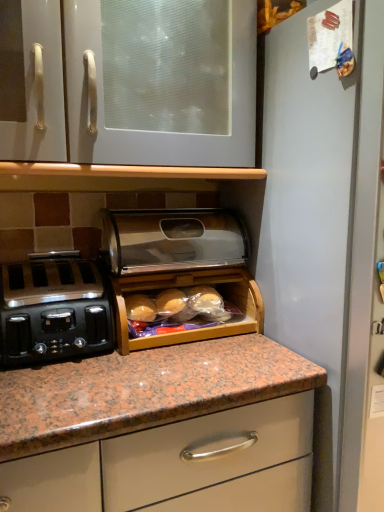
The image size is (384, 512). What do you see at coordinates (129, 82) in the screenshot? I see `white glossy cabinet at upper center` at bounding box center [129, 82].

This screenshot has width=384, height=512. What do you see at coordinates (53, 310) in the screenshot?
I see `satin black toaster at left` at bounding box center [53, 310].

Identify the location of wooden bread box at center, which is the first appliance from bottom to top. (180, 266).

At what (x,y) coordinates should I click in order to perform the action: click on polished stainless steel bread box at center, which appears as the 1th appliance when viewed from the top. Please return your answer as a coordinate pair (x, y). Looking at the image, I should click on (173, 240).

Which of these two, satin black toaster at left or polished stainless steel bread box at center, the 2th appliance ordered from the bottom, is smaller?

satin black toaster at left.

Is satin black toaster at left facing away from polished stainless steel bread box at center, the 2th appliance ordered from the bottom?

No, satin black toaster at left is not facing the opposite direction of polished stainless steel bread box at center, the 2th appliance ordered from the bottom.

From the image's perspective, is satin black toaster at left on polished stainless steel bread box at center, which appears as the 1th appliance when viewed from the top?

No, from the image's perspective, satin black toaster at left is not over polished stainless steel bread box at center, which appears as the 1th appliance when viewed from the top.

Choose the correct answer: Is satin black toaster at left inside polished stainless steel bread box at center, the 2th appliance ordered from the bottom, or outside it?

satin black toaster at left is not enclosed by polished stainless steel bread box at center, the 2th appliance ordered from the bottom.

Is satin black toaster at left oriented away from white glossy cabinet at upper center?

No, satin black toaster at left is not facing the opposite direction of white glossy cabinet at upper center.

Considering the sizes of objects satin black toaster at left and white glossy cabinet at upper center in the image provided, who is thinner, satin black toaster at left or white glossy cabinet at upper center?

satin black toaster at left.

Which point is more distant from viewer, (x=34, y=279) or (x=226, y=12)?

Point (x=34, y=279)

Is satin black toaster at left behind white glossy cabinet at upper center?

Yes, it is behind white glossy cabinet at upper center.

Which point is more forward, (96, 310) or (106, 241)?

Positioned in front is point (96, 310).

Is satin black toaster at left taller than wooden bread box at center, the second appliance from the top?

Yes, satin black toaster at left is taller than wooden bread box at center, the second appliance from the top.

Looking at this image, is satin black toaster at left positioned with its back to wooden bread box at center, the second appliance from the top?

No.

Which of these two, satin black toaster at left or wooden bread box at center, the second appliance from the top, is wider?

With larger width is satin black toaster at left.

Is wooden bread box at center, which is the first appliance from bottom to top, wider than polished stainless steel bread box at center, which appears as the 1th appliance when viewed from the top?

No, wooden bread box at center, which is the first appliance from bottom to top, is not wider than polished stainless steel bread box at center, which appears as the 1th appliance when viewed from the top.

Is polished stainless steel bread box at center, which appears as the 1th appliance when viewed from the top, a part of wooden bread box at center, which is the first appliance from bottom to top?

Actually, polished stainless steel bread box at center, which appears as the 1th appliance when viewed from the top, is outside wooden bread box at center, which is the first appliance from bottom to top.

Does wooden bread box at center, which is the first appliance from bottom to top, have a smaller size compared to polished stainless steel bread box at center, the 2th appliance ordered from the bottom?

Correct, wooden bread box at center, which is the first appliance from bottom to top, occupies less space than polished stainless steel bread box at center, the 2th appliance ordered from the bottom.

From a real-world perspective, is wooden bread box at center, which is the first appliance from bottom to top, over polished stainless steel bread box at center, the 2th appliance ordered from the bottom?

No.

From the image's perspective, is wooden bread box at center, which is the first appliance from bottom to top, positioned above or below satin black toaster at left?

From the image's perspective, wooden bread box at center, which is the first appliance from bottom to top, appears below satin black toaster at left.

Based on the photo, is wooden bread box at center, the second appliance from the top, aimed at satin black toaster at left?

No, wooden bread box at center, the second appliance from the top, is not aimed at satin black toaster at left.

You are a GUI agent. You are given a task and a screenshot of the screen. Output one action in this format:
    pyautogui.click(x=<x>, y=<y>)
    Task: Click on the home appliance that is above the wooden bread box at center, which is the first appliance from bottom to top (from the image's perspective)
    The height and width of the screenshot is (512, 384).
    Given the screenshot: What is the action you would take?
    pyautogui.click(x=53, y=310)

Considering the points (30, 8) and (143, 262), which point is in front, point (30, 8) or point (143, 262)?

Point (30, 8)

Can we say white glossy cabinet at upper center lies outside polished stainless steel bread box at center, which appears as the 1th appliance when viewed from the top?

Indeed, white glossy cabinet at upper center is completely outside polished stainless steel bread box at center, which appears as the 1th appliance when viewed from the top.

Is white glossy cabinet at upper center behind polished stainless steel bread box at center, which appears as the 1th appliance when viewed from the top?

No, it is in front of polished stainless steel bread box at center, which appears as the 1th appliance when viewed from the top.

Can you confirm if white glossy cabinet at upper center is thinner than polished stainless steel bread box at center, the 2th appliance ordered from the bottom?

In fact, white glossy cabinet at upper center might be wider than polished stainless steel bread box at center, the 2th appliance ordered from the bottom.

Is white glossy cabinet at upper center oriented away from wooden bread box at center, which is the first appliance from bottom to top?

No.

Where is `appliance that is the 1st object located behind the white glossy cabinet at upper center`? The width and height of the screenshot is (384, 512). appliance that is the 1st object located behind the white glossy cabinet at upper center is located at coordinates (180, 266).

Considering the relative sizes of white glossy cabinet at upper center and wooden bread box at center, the second appliance from the top, in the image provided, is white glossy cabinet at upper center thinner than wooden bread box at center, the second appliance from the top,?

No.

You are a GUI agent. You are given a task and a screenshot of the screen. Output one action in this format:
    pyautogui.click(x=<x>, y=<y>)
    Task: Click on the home appliance that appears below the polished stainless steel bread box at center, the 2th appliance ordered from the bottom (from a real-world perspective)
    The width and height of the screenshot is (384, 512).
    Given the screenshot: What is the action you would take?
    pyautogui.click(x=53, y=310)

Locate an element on the screen. home appliance on the left of white glossy cabinet at upper center is located at coordinates (53, 310).

When comparing their distances from wooden bread box at center, the second appliance from the top, does polished stainless steel bread box at center, which appears as the 1th appliance when viewed from the top, or white glossy cabinet at upper center seem closer?

polished stainless steel bread box at center, which appears as the 1th appliance when viewed from the top, lies closer to wooden bread box at center, the second appliance from the top, than the other object.

Which object lies nearer to the anchor point satin black toaster at left, wooden bread box at center, which is the first appliance from bottom to top, or white glossy cabinet at upper center?

Among the two, wooden bread box at center, which is the first appliance from bottom to top, is located nearer to satin black toaster at left.

Based on their spatial positions, is polished stainless steel bread box at center, which appears as the 1th appliance when viewed from the top, or wooden bread box at center, the second appliance from the top, closer to white glossy cabinet at upper center?

polished stainless steel bread box at center, which appears as the 1th appliance when viewed from the top, is closer to white glossy cabinet at upper center.

Based on their spatial positions, is satin black toaster at left or white glossy cabinet at upper center closer to wooden bread box at center, the second appliance from the top?

Among the two, satin black toaster at left is located nearer to wooden bread box at center, the second appliance from the top.

From the image, which object appears to be farther from satin black toaster at left, wooden bread box at center, the second appliance from the top, or polished stainless steel bread box at center, the 2th appliance ordered from the bottom?

polished stainless steel bread box at center, the 2th appliance ordered from the bottom, is further to satin black toaster at left.

Which object lies nearer to the anchor point satin black toaster at left, polished stainless steel bread box at center, the 2th appliance ordered from the bottom, or wooden bread box at center, which is the first appliance from bottom to top?

wooden bread box at center, which is the first appliance from bottom to top.

Looking at the image, which one is located further to satin black toaster at left, white glossy cabinet at upper center or wooden bread box at center, the second appliance from the top?

white glossy cabinet at upper center lies further to satin black toaster at left than the other object.

Based on their spatial positions, is satin black toaster at left or wooden bread box at center, the second appliance from the top, closer to white glossy cabinet at upper center?

Based on the image, wooden bread box at center, the second appliance from the top, appears to be nearer to white glossy cabinet at upper center.

Where is `home appliance between white glossy cabinet at upper center and wooden bread box at center, the second appliance from the top, vertically`? home appliance between white glossy cabinet at upper center and wooden bread box at center, the second appliance from the top, vertically is located at coordinates (53, 310).

Find the location of `appliance located between satin black toaster at left and wooden bread box at center, the second appliance from the top, in the left-right direction`. appliance located between satin black toaster at left and wooden bread box at center, the second appliance from the top, in the left-right direction is located at coordinates 173,240.

Identify the location of appliance between white glossy cabinet at upper center and satin black toaster at left in the vertical direction. (173, 240).

Where is `appliance that lies between white glossy cabinet at upper center and wooden bread box at center, which is the first appliance from bottom to top, from top to bottom`? This screenshot has height=512, width=384. appliance that lies between white glossy cabinet at upper center and wooden bread box at center, which is the first appliance from bottom to top, from top to bottom is located at coordinates (173, 240).